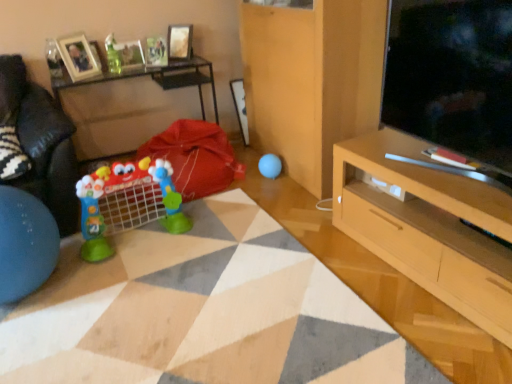
Question: Is wooden table at left bigger or smaller than matte glass picture frame at upper left, the second picture frame in the right-to-left sequence?

Choices:
 (A) small
 (B) big

Answer: (B)

Question: From the image's perspective, is wooden table at left above or below matte glass picture frame at upper left, the second picture frame in the right-to-left sequence?

Choices:
 (A) above
 (B) below

Answer: (B)

Question: Which of these objects is positioned farthest from the metallic silver picture frame at upper center, marked as the 3th picture frame in a left-to-right arrangement?

Choices:
 (A) black fuzzy pillow at left
 (B) translucent glass vase at upper left, arranged as the 2th toy when viewed from the front
 (C) light wood cabinet at lower right
 (D) wooden table at left
 (E) matte black tv at right

Answer: (E)

Question: Which object is the farthest from the translucent glass vase at upper left, the 3th toy positioned from the right?

Choices:
 (A) matte glass picture frame at upper left, the second picture frame in the right-to-left sequence
 (B) black leather couch at left
 (C) matte black tv at right
 (D) blue rubber ball at center, the first toy from the right
 (E) black fuzzy pillow at left

Answer: (C)